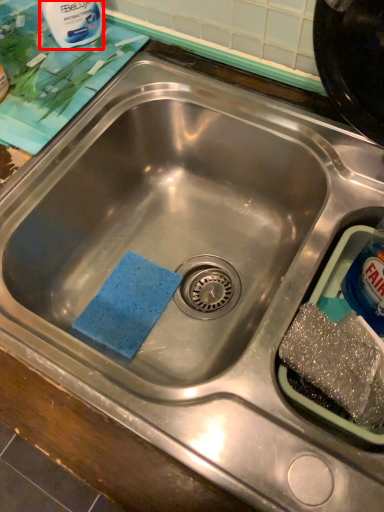
Question: Considering the relative positions of cleaning product (annotated by the red box) and bottle in the image provided, where is cleaning product (annotated by the red box) located with respect to the staircase?

Choices:
 (A) left
 (B) right

Answer: (A)